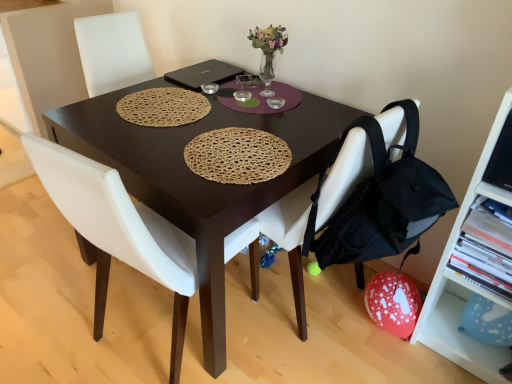
Find the location of a particular element. This screenshot has height=384, width=512. free region on the left part of white plastic chair at center, acting as the 1th chair starting from the left is located at coordinates (58, 314).